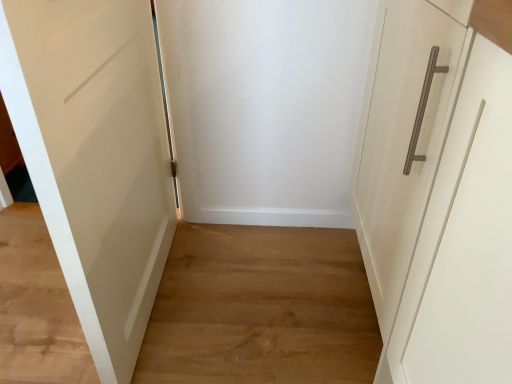
Question: Is the surface of white matte door at left in direct contact with wooden floor at center?

Choices:
 (A) no
 (B) yes

Answer: (A)

Question: Would you consider white matte door at left to be distant from wooden floor at center?

Choices:
 (A) yes
 (B) no

Answer: (B)

Question: Can you confirm if white matte door at left is shorter than wooden floor at center?

Choices:
 (A) yes
 (B) no

Answer: (B)

Question: From the image's perspective, is white matte door at left located above wooden floor at center?

Choices:
 (A) yes
 (B) no

Answer: (A)

Question: Is the position of white matte door at left more distant than that of wooden floor at center?

Choices:
 (A) yes
 (B) no

Answer: (B)

Question: Is white matte door at left surrounding wooden floor at center?

Choices:
 (A) no
 (B) yes

Answer: (A)

Question: Does wooden floor at center have a greater height compared to white matte door at left?

Choices:
 (A) yes
 (B) no

Answer: (B)

Question: Can you see wooden floor at center touching white matte door at left?

Choices:
 (A) yes
 (B) no

Answer: (B)

Question: From a real-world perspective, is wooden floor at center over white matte door at left?

Choices:
 (A) no
 (B) yes

Answer: (A)

Question: Is wooden floor at center shorter than white matte door at left?

Choices:
 (A) no
 (B) yes

Answer: (B)

Question: Considering the relative positions of wooden floor at center and white matte door at left in the image provided, is wooden floor at center to the left of white matte door at left from the viewer's perspective?

Choices:
 (A) no
 (B) yes

Answer: (B)

Question: Can you confirm if wooden floor at center is bigger than white matte door at left?

Choices:
 (A) yes
 (B) no

Answer: (B)

Question: From a real-world perspective, relative to wooden floor at center, is white matte door at left vertically above or below?

Choices:
 (A) below
 (B) above

Answer: (B)